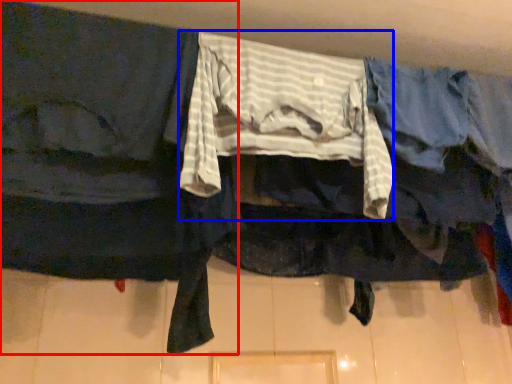
Question: Among these objects, which one is nearest to the camera, robe (highlighted by a red box) or clothing (highlighted by a blue box)?

Choices:
 (A) robe
 (B) clothing

Answer: (A)